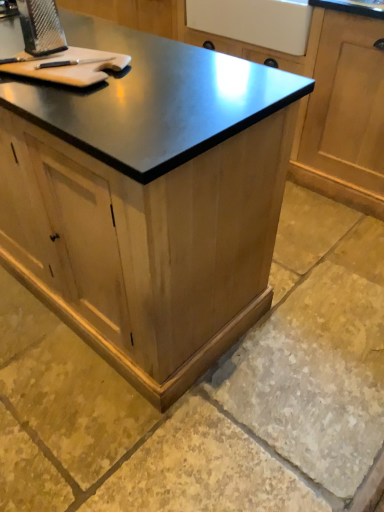
Identify the location of natural stone floor at lower center. This screenshot has width=384, height=512. (212, 394).

What do you see at coordinates (212, 394) in the screenshot? I see `natural stone floor at lower center` at bounding box center [212, 394].

Image resolution: width=384 pixels, height=512 pixels. What do you see at coordinates (41, 27) in the screenshot?
I see `metallic grater at upper left` at bounding box center [41, 27].

Identify the location of metallic grater at upper left. (41, 27).

Where is `wooden cabinet at center, arranged as the second cabinetry when viewed from the front`? The height and width of the screenshot is (512, 384). wooden cabinet at center, arranged as the second cabinetry when viewed from the front is located at coordinates (306, 97).

Where is `light brown wood cutting board at upper left`? Image resolution: width=384 pixels, height=512 pixels. light brown wood cutting board at upper left is located at coordinates (69, 66).

The height and width of the screenshot is (512, 384). What are the coordinates of `wooden cabinet at center, which ranks as the second cabinetry in back-to-front order` in the screenshot? It's located at (148, 200).

Is metallic grater at upper left next to light brown wood cutting board at upper left?

Yes, metallic grater at upper left is with light brown wood cutting board at upper left.

Which of these two, metallic grater at upper left or light brown wood cutting board at upper left, is wider?

light brown wood cutting board at upper left is wider.

Which is nearer, (66, 49) or (5, 71)?

Point (66, 49).

From a real-world perspective, is metallic grater at upper left on top of light brown wood cutting board at upper left?

Indeed, from a real-world perspective, metallic grater at upper left stands above light brown wood cutting board at upper left.

Does natural stone floor at lower center contain wooden cabinet at center, marked as the 1th cabinetry in a back-to-front arrangement?

No, wooden cabinet at center, marked as the 1th cabinetry in a back-to-front arrangement, is not surrounded by natural stone floor at lower center.

Which object is more forward, natural stone floor at lower center or wooden cabinet at center, arranged as the second cabinetry when viewed from the front?

natural stone floor at lower center is closer to the camera.

Is natural stone floor at lower center smaller than wooden cabinet at center, marked as the 1th cabinetry in a back-to-front arrangement?

Yes.

Looking at this image, is metallic grater at upper left not near wooden cabinet at center, arranged as the second cabinetry when viewed from the front?

metallic grater at upper left is positioned a significant distance from wooden cabinet at center, arranged as the second cabinetry when viewed from the front.

Considering their positions, is metallic grater at upper left located in front of or behind wooden cabinet at center, arranged as the second cabinetry when viewed from the front?

metallic grater at upper left is positioned closer to the viewer than wooden cabinet at center, arranged as the second cabinetry when viewed from the front.

In terms of width, does metallic grater at upper left look wider or thinner when compared to wooden cabinet at center, marked as the 1th cabinetry in a back-to-front arrangement?

Clearly, metallic grater at upper left has less width compared to wooden cabinet at center, marked as the 1th cabinetry in a back-to-front arrangement.

Does point (27, 36) lie in front of point (356, 63)?

Yes, it is.

From a real-world perspective, does light brown wood cutting board at upper left stand above wooden cabinet at center, marked as the 1th cabinetry in a back-to-front arrangement?

Yes, from a real-world perspective, light brown wood cutting board at upper left is above wooden cabinet at center, marked as the 1th cabinetry in a back-to-front arrangement.

Is light brown wood cutting board at upper left situated inside wooden cabinet at center, marked as the 1th cabinetry in a back-to-front arrangement, or outside?

The correct answer is: outside.

Who is shorter, wooden cabinet at center, arranged as the second cabinetry when viewed from the front, or light brown wood cutting board at upper left?

light brown wood cutting board at upper left.

From the image's perspective, is wooden cabinet at center, marked as the 1th cabinetry in a back-to-front arrangement, on top of light brown wood cutting board at upper left?

Indeed, from the image's perspective, wooden cabinet at center, marked as the 1th cabinetry in a back-to-front arrangement, is shown above light brown wood cutting board at upper left.

Find the location of a particular element. This screenshot has width=384, height=512. the 2nd cabinetry directly beneath the light brown wood cutting board at upper left (from a real-world perspective) is located at coordinates (306, 97).

Is metallic grater at upper left bigger than wooden cabinet at center, which is the 1th cabinetry from front to back?

No, metallic grater at upper left is not bigger than wooden cabinet at center, which is the 1th cabinetry from front to back.

Which object is positioned more to the left, metallic grater at upper left or wooden cabinet at center, which ranks as the second cabinetry in back-to-front order?

wooden cabinet at center, which ranks as the second cabinetry in back-to-front order.

Could wooden cabinet at center, which ranks as the second cabinetry in back-to-front order, be considered to be inside metallic grater at upper left?

No, wooden cabinet at center, which ranks as the second cabinetry in back-to-front order, is not surrounded by metallic grater at upper left.

Considering the points (28, 2) and (15, 88), which point is in front, point (28, 2) or point (15, 88)?

The point (15, 88) is closer to the camera.

Could you tell me if light brown wood cutting board at upper left is turned towards natural stone floor at lower center?

No, light brown wood cutting board at upper left is not turned towards natural stone floor at lower center.

Which object is closer to the camera, light brown wood cutting board at upper left or natural stone floor at lower center?

natural stone floor at lower center.

Which is in front, point (42, 74) or point (15, 505)?

Positioned in front is point (42, 74).

In the image, there is a metallic grater at upper left. Identify the location of cutting board below it (from the image's perspective). (69, 66).

The width and height of the screenshot is (384, 512). I want to click on cabinetry on the right of natural stone floor at lower center, so click(x=306, y=97).

Looking at the image, which one is located closer to natural stone floor at lower center, wooden cabinet at center, marked as the 1th cabinetry in a back-to-front arrangement, or light brown wood cutting board at upper left?

The object closer to natural stone floor at lower center is light brown wood cutting board at upper left.

Considering their positions, is metallic grater at upper left positioned closer to wooden cabinet at center, which ranks as the second cabinetry in back-to-front order, than natural stone floor at lower center?

natural stone floor at lower center is closer to wooden cabinet at center, which ranks as the second cabinetry in back-to-front order.

Considering their positions, is light brown wood cutting board at upper left positioned closer to wooden cabinet at center, marked as the 1th cabinetry in a back-to-front arrangement, than wooden cabinet at center, which ranks as the second cabinetry in back-to-front order?

wooden cabinet at center, which ranks as the second cabinetry in back-to-front order.

From the image, which object appears to be nearer to metallic grater at upper left, natural stone floor at lower center or wooden cabinet at center, which is the 1th cabinetry from front to back?

Among the two, wooden cabinet at center, which is the 1th cabinetry from front to back, is located nearer to metallic grater at upper left.

When comparing their distances from metallic grater at upper left, does wooden cabinet at center, arranged as the second cabinetry when viewed from the front, or wooden cabinet at center, which is the 1th cabinetry from front to back, seem closer?

The object closer to metallic grater at upper left is wooden cabinet at center, which is the 1th cabinetry from front to back.

Based on their spatial positions, is wooden cabinet at center, which is the 1th cabinetry from front to back, or natural stone floor at lower center further from metallic grater at upper left?

natural stone floor at lower center lies further to metallic grater at upper left than the other object.

Which object lies nearer to the anchor point metallic grater at upper left, wooden cabinet at center, arranged as the second cabinetry when viewed from the front, or natural stone floor at lower center?

The object closer to metallic grater at upper left is natural stone floor at lower center.

When comparing their distances from wooden cabinet at center, marked as the 1th cabinetry in a back-to-front arrangement, does wooden cabinet at center, which is the 1th cabinetry from front to back, or natural stone floor at lower center seem closer?

Based on the image, natural stone floor at lower center appears to be nearer to wooden cabinet at center, marked as the 1th cabinetry in a back-to-front arrangement.

What are the coordinates of `appliance between wooden cabinet at center, arranged as the second cabinetry when viewed from the front, and light brown wood cutting board at upper left, in the vertical direction` in the screenshot? It's located at (41, 27).

Identify the location of cutting board between wooden cabinet at center, which ranks as the second cabinetry in back-to-front order, and natural stone floor at lower center from left to right. (69, 66).

Where is `appliance located between wooden cabinet at center, which ranks as the second cabinetry in back-to-front order, and light brown wood cutting board at upper left in the left-right direction`? The width and height of the screenshot is (384, 512). appliance located between wooden cabinet at center, which ranks as the second cabinetry in back-to-front order, and light brown wood cutting board at upper left in the left-right direction is located at coordinates (41, 27).

The width and height of the screenshot is (384, 512). I want to click on cabinetry between wooden cabinet at center, marked as the 1th cabinetry in a back-to-front arrangement, and natural stone floor at lower center from top to bottom, so click(148, 200).